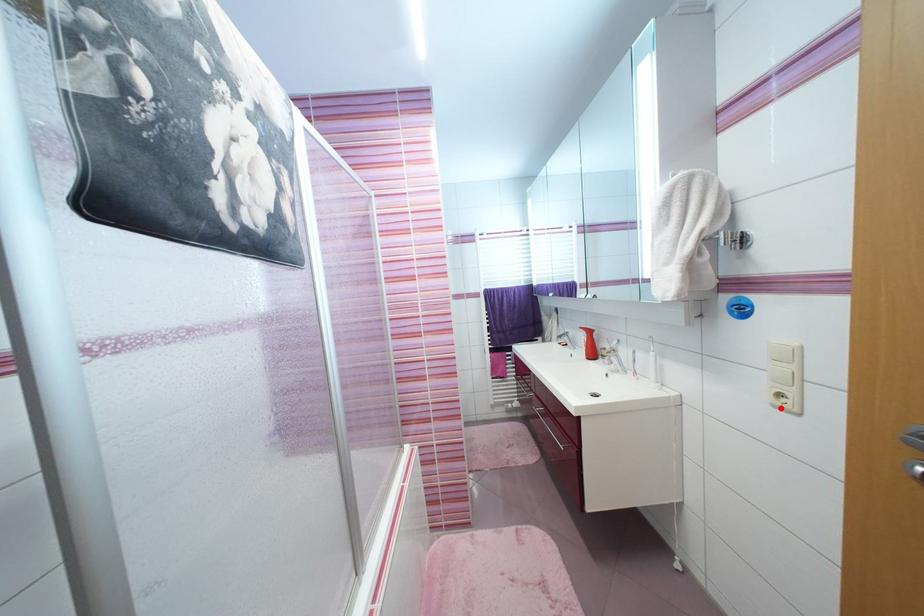
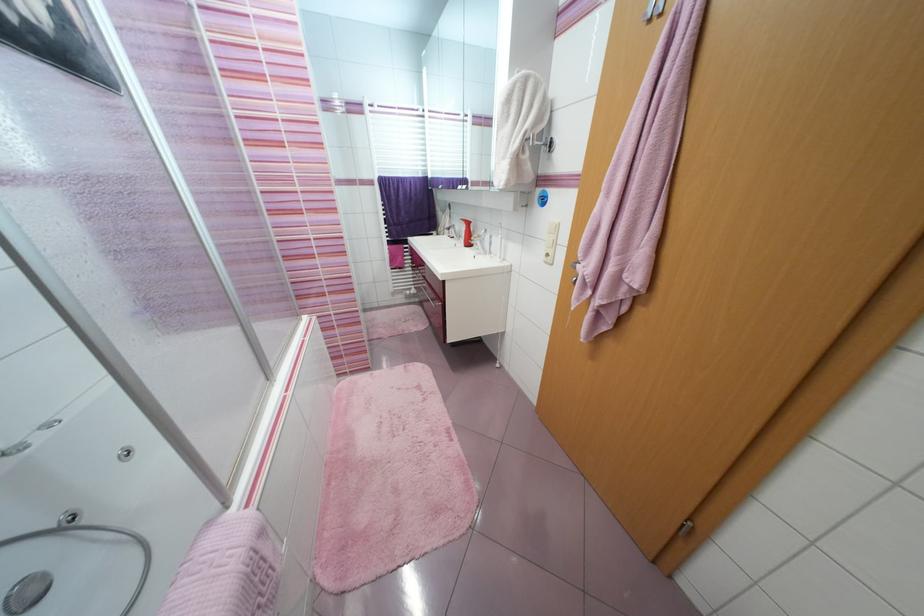
Find the pixel in the second image that matches the highlighted location in the first image.

(551, 264)